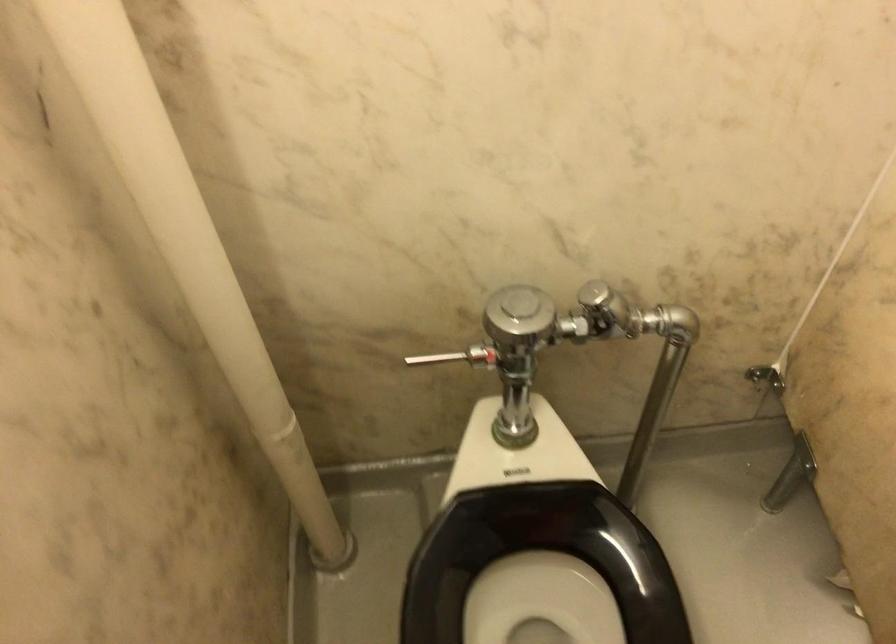
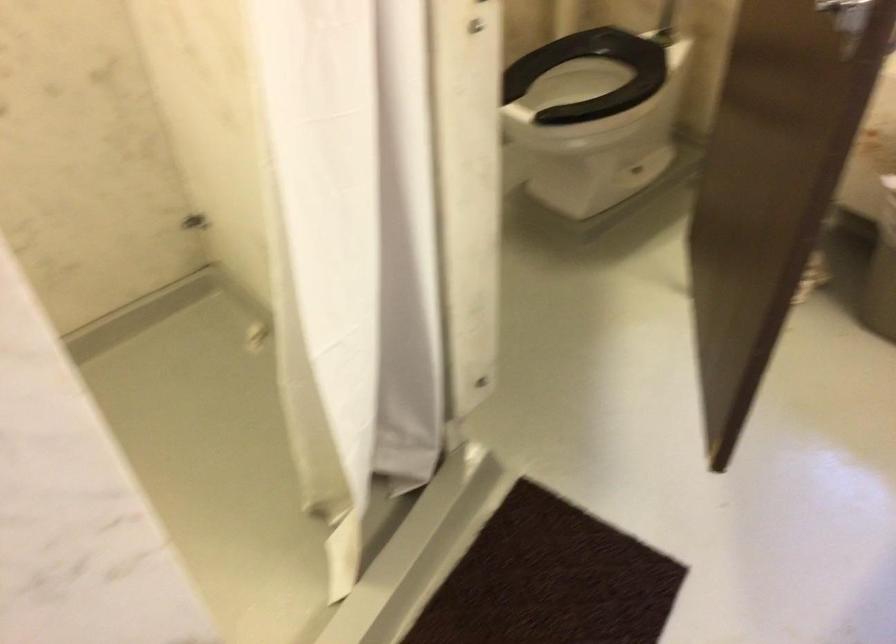
Locate, in the second image, the point that corresponds to (464,571) in the first image.

(591, 75)